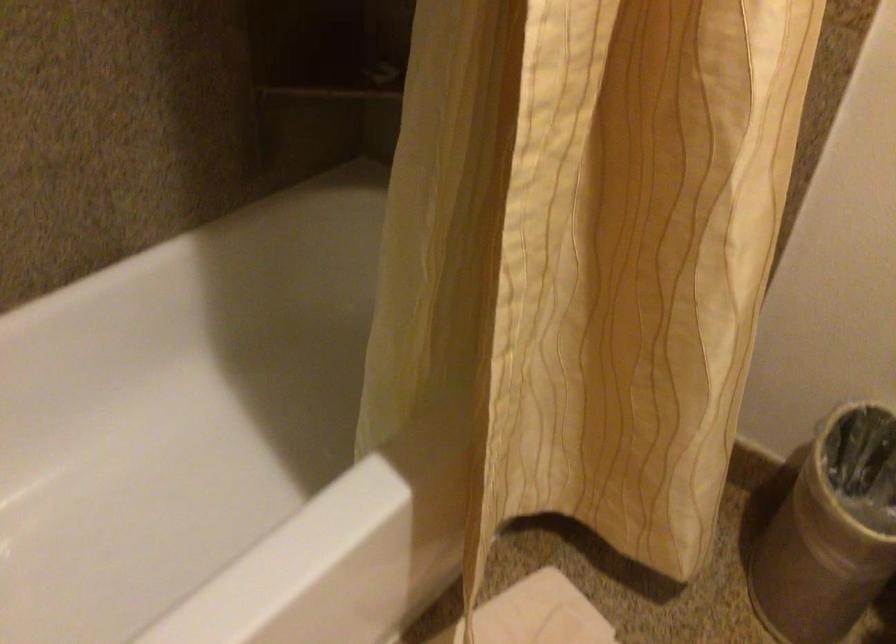
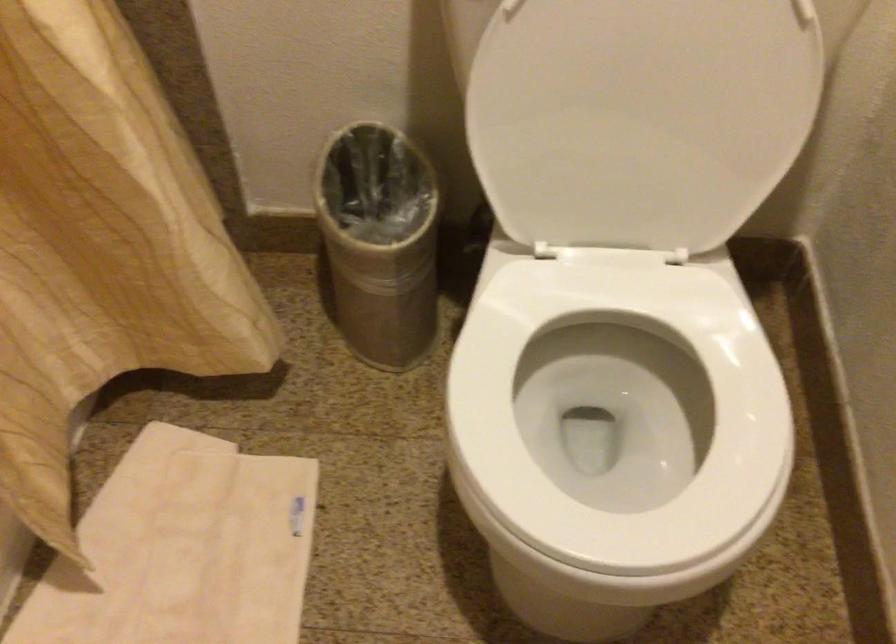
The first image is from the beginning of the video and the second image is from the end. How did the camera likely rotate when shooting the video?

The rotation direction of the camera is right-down.